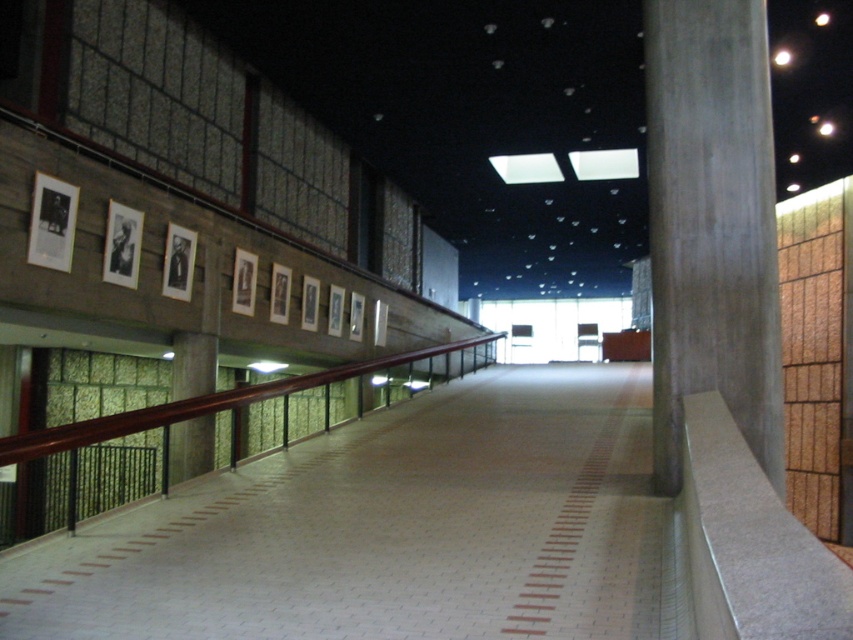
You are standing in the corridor and want to place a small potted plant exactly at the center of the white tile floor at center. According to the coordinates provided, where should you place the plant?

The white tile floor at center should have the plant placed at its exact center coordinates, which are given as point (392, 529).

You are standing in the corridor and want to place a small potted plant exactly at the center of the white tile floor at center. According to the coordinates provided, where should you place the plant?

The white tile floor at center is located at point (392, 529), so you should place the plant there.

You are standing in the corridor and want to place a tall sculpture that requires a flat surface. Which object between the white tile floor at center and the gray concrete pillar at right would be suitable for placing the sculpture?

The white tile floor at center is suitable for placing the sculpture since it provides a flat surface, whereas the gray concrete pillar at right is taller and likely not flat enough.